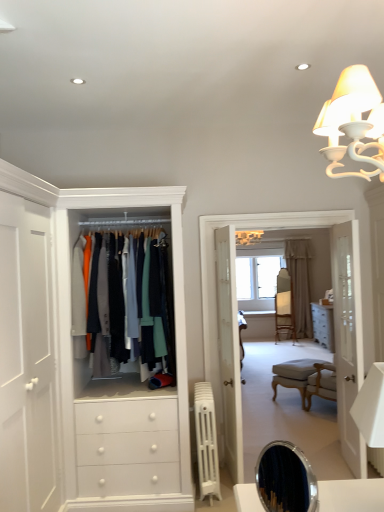
Question: Does beige fabric curtain at center appear on the right side of wooden armchair at center?

Choices:
 (A) no
 (B) yes

Answer: (B)

Question: Does beige fabric curtain at center touch wooden armchair at center?

Choices:
 (A) no
 (B) yes

Answer: (A)

Question: Is beige fabric curtain at center in front of wooden armchair at center?

Choices:
 (A) no
 (B) yes

Answer: (A)

Question: Is beige fabric curtain at center facing away from wooden armchair at center?

Choices:
 (A) no
 (B) yes

Answer: (A)

Question: From a real-world perspective, is beige fabric curtain at center positioned under wooden armchair at center based on gravity?

Choices:
 (A) no
 (B) yes

Answer: (A)

Question: From the image's perspective, relative to white leather ottoman at lower right, is wooden armchair at center above or below?

Choices:
 (A) above
 (B) below

Answer: (A)

Question: Choose the correct answer: Is wooden armchair at center inside white leather ottoman at lower right or outside it?

Choices:
 (A) outside
 (B) inside

Answer: (A)

Question: From a real-world perspective, is wooden armchair at center positioned above or below white leather ottoman at lower right?

Choices:
 (A) above
 (B) below

Answer: (A)

Question: Visually, is wooden armchair at center positioned to the left or to the right of white leather ottoman at lower right?

Choices:
 (A) right
 (B) left

Answer: (A)

Question: In terms of height, does matte fabric jackets at center look taller or shorter compared to wooden floor at center?

Choices:
 (A) short
 (B) tall

Answer: (A)

Question: From a real-world perspective, is matte fabric jackets at center above or below wooden floor at center?

Choices:
 (A) above
 (B) below

Answer: (A)

Question: Considering the positions of matte fabric jackets at center and wooden floor at center in the image, is matte fabric jackets at center wider or thinner than wooden floor at center?

Choices:
 (A) wide
 (B) thin

Answer: (A)

Question: In the image, is matte fabric jackets at center positioned in front of or behind wooden floor at center?

Choices:
 (A) front
 (B) behind

Answer: (A)

Question: Which is correct: wooden floor at center is inside white glass door at right, or outside of it?

Choices:
 (A) outside
 (B) inside

Answer: (A)

Question: From a real-world perspective, is wooden floor at center physically located above or below white glass door at right?

Choices:
 (A) below
 (B) above

Answer: (B)